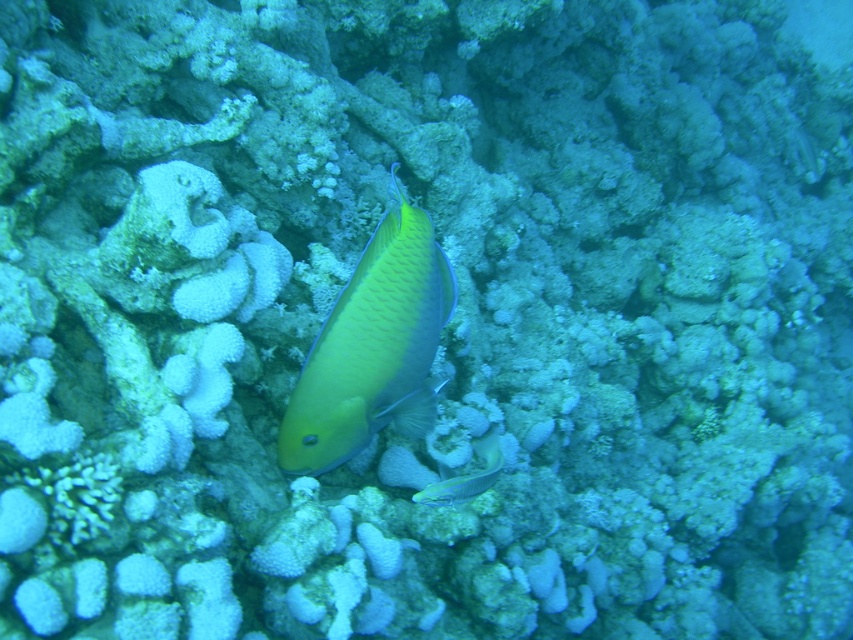
Question: Observing the image, what is the correct spatial positioning of yellow matte fish at center in reference to shiny blue fish at center?

Choices:
 (A) above
 (B) below

Answer: (A)

Question: Which object is farther from the camera taking this photo?

Choices:
 (A) shiny blue fish at center
 (B) yellow matte fish at center

Answer: (A)

Question: Can you confirm if yellow matte fish at center is smaller than shiny blue fish at center?

Choices:
 (A) no
 (B) yes

Answer: (A)

Question: Is yellow matte fish at center thinner than shiny blue fish at center?

Choices:
 (A) no
 (B) yes

Answer: (A)